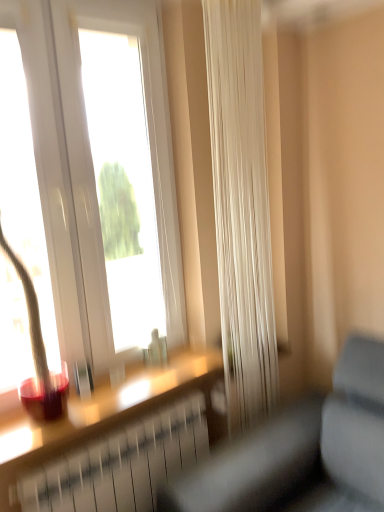
Question: From the image's perspective, is gray fabric couch at lower right beneath matte glass window sill at lower left?

Choices:
 (A) yes
 (B) no

Answer: (A)

Question: Considering the relative sizes of gray fabric couch at lower right and matte glass window sill at lower left in the image provided, is gray fabric couch at lower right smaller than matte glass window sill at lower left?

Choices:
 (A) no
 (B) yes

Answer: (A)

Question: Can you confirm if gray fabric couch at lower right is positioned to the right of matte glass window sill at lower left?

Choices:
 (A) yes
 (B) no

Answer: (A)

Question: From a real-world perspective, does gray fabric couch at lower right stand above matte glass window sill at lower left?

Choices:
 (A) no
 (B) yes

Answer: (A)

Question: Is gray fabric couch at lower right positioned far away from matte glass window sill at lower left?

Choices:
 (A) no
 (B) yes

Answer: (A)

Question: Is matte glass window sill at lower left at the back of gray fabric couch at lower right?

Choices:
 (A) yes
 (B) no

Answer: (B)

Question: Is matte glass window sill at lower left in front of gray fabric couch at lower right?

Choices:
 (A) yes
 (B) no

Answer: (B)

Question: From the image's perspective, is matte glass window sill at lower left on gray fabric couch at lower right?

Choices:
 (A) yes
 (B) no

Answer: (A)

Question: Does matte glass window sill at lower left have a greater height compared to gray fabric couch at lower right?

Choices:
 (A) yes
 (B) no

Answer: (B)

Question: Does matte glass window sill at lower left have a greater width compared to gray fabric couch at lower right?

Choices:
 (A) yes
 (B) no

Answer: (B)

Question: Is matte glass window sill at lower left outside of gray fabric couch at lower right?

Choices:
 (A) yes
 (B) no

Answer: (A)

Question: Would you say gray fabric couch at lower right is part of matte glass window sill at lower left's contents?

Choices:
 (A) no
 (B) yes

Answer: (A)

Question: Is white sheer curtain at center taller than matte glass window sill at lower left?

Choices:
 (A) no
 (B) yes

Answer: (B)